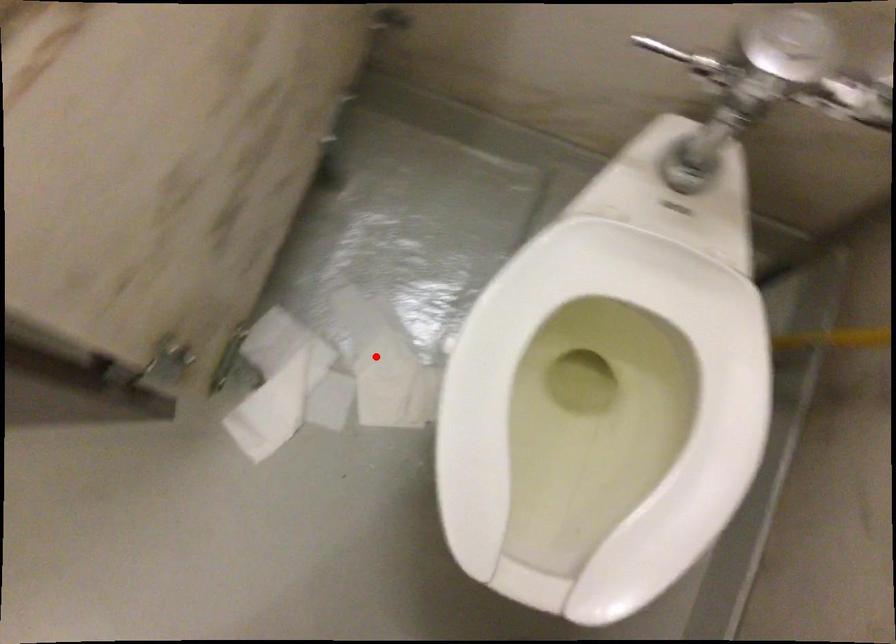
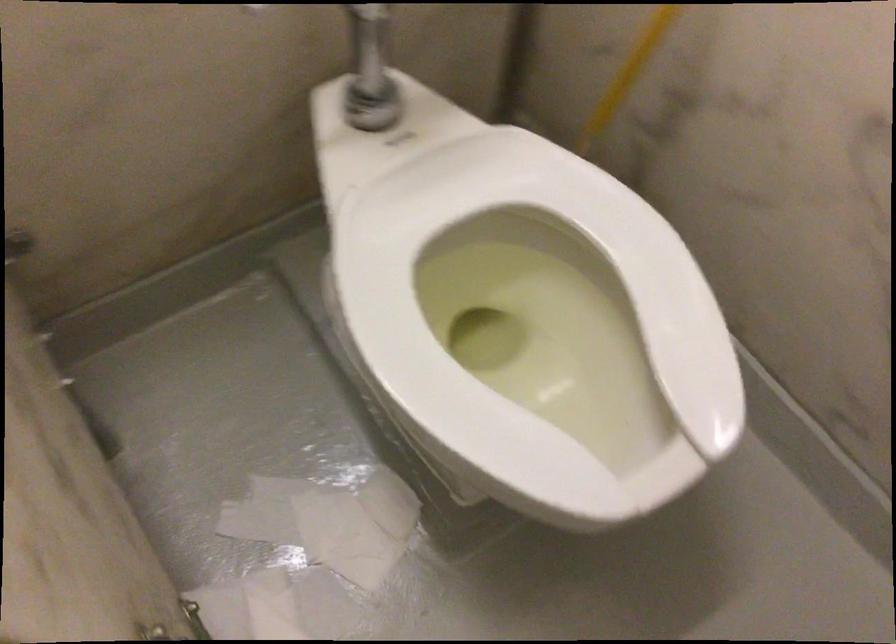
Locate, in the second image, the point that corresponds to the highlighted location in the first image.

(320, 529)